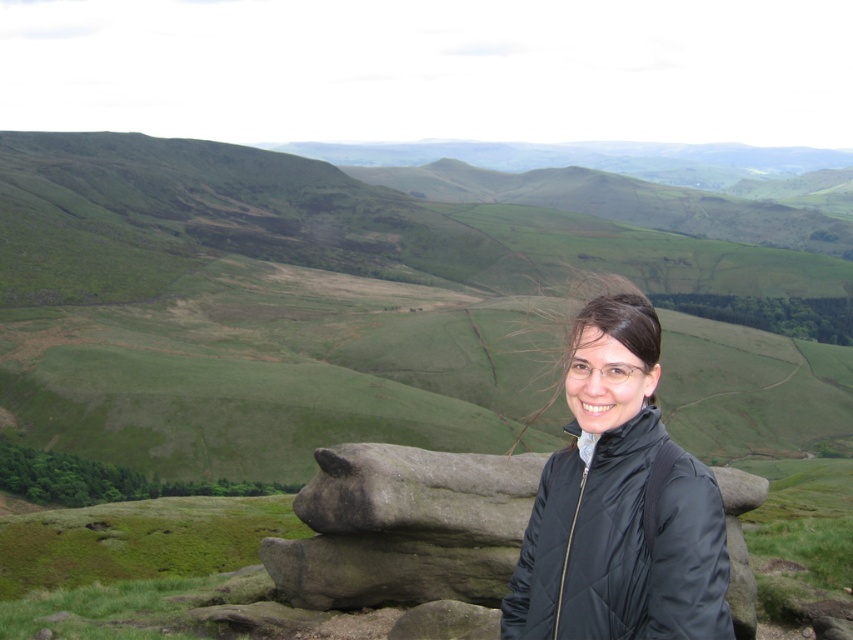
Question: Is green grassy hillside at center to the right of black quilted jacket at center from the viewer's perspective?

Choices:
 (A) no
 (B) yes

Answer: (B)

Question: Is green grassy hillside at center positioned at the back of rough stone boulder at center?

Choices:
 (A) yes
 (B) no

Answer: (A)

Question: Does green grassy hillside at center appear on the left side of rough stone boulder at center?

Choices:
 (A) no
 (B) yes

Answer: (A)

Question: Considering the real-world distances, which object is closest to the rough stone boulder at center?

Choices:
 (A) black quilted jacket at center
 (B) green grassy hillside at center

Answer: (A)

Question: Which point is farther to the camera?

Choices:
 (A) black quilted jacket at center
 (B) rough stone boulder at center
 (C) green grassy hillside at center

Answer: (C)

Question: Which point is closer to the camera?

Choices:
 (A) black quilted jacket at center
 (B) rough stone boulder at center
 (C) green grassy hillside at center

Answer: (A)